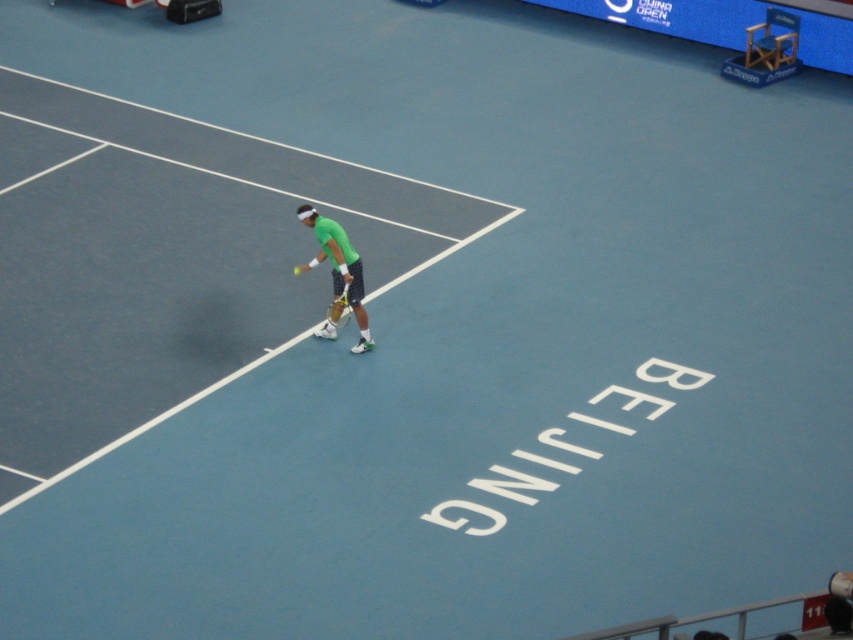
Between green matte tennis racket at center and yellow-green synthetic racket at center, which one has less height?

With less height is yellow-green synthetic racket at center.

Who is more forward, (338, 262) or (328, 310)?

Point (338, 262) is more forward.

The width and height of the screenshot is (853, 640). Identify the location of green matte tennis racket at center. (337, 275).